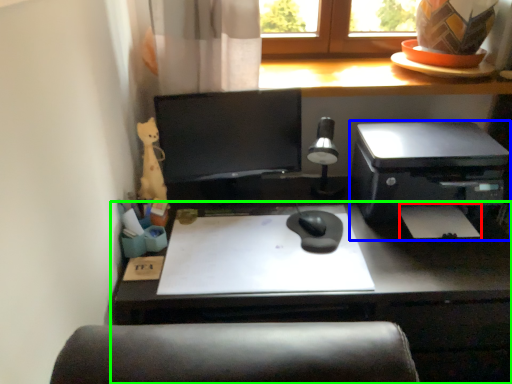
Question: Which is nearer to the notepad (highlighted by a red box)? printer (highlighted by a blue box) or desk (highlighted by a green box).

Choices:
 (A) printer
 (B) desk

Answer: (A)